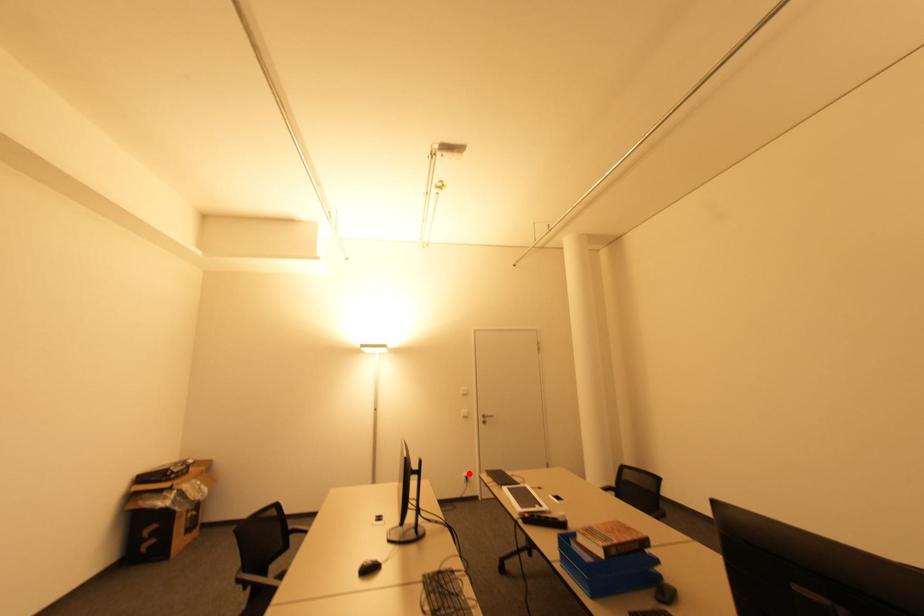
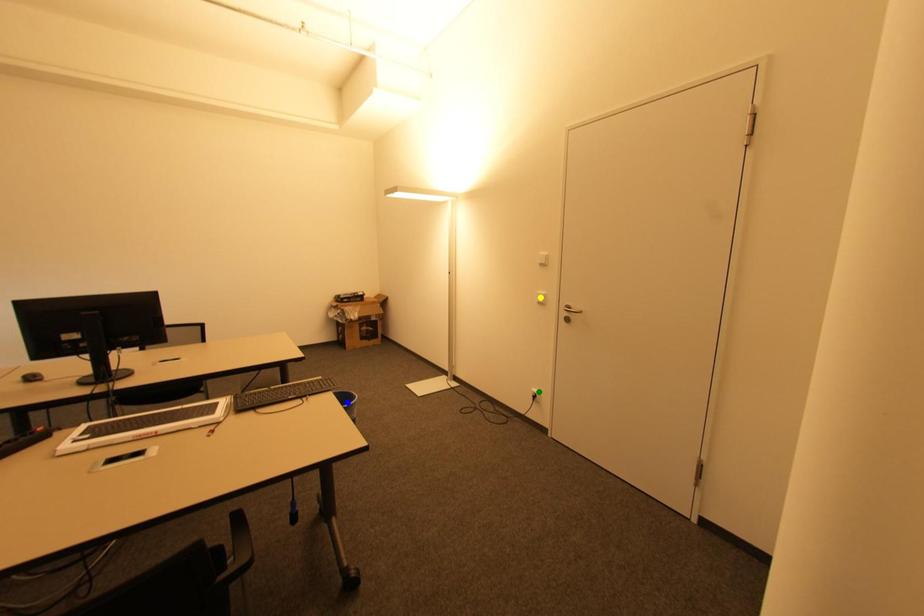
Question: I am providing you with two images of the same scene from different viewpoints. A red point is marked on the first image. You are given multiple points on the second image. In image 2, which mark is for the same physical point as the one in image 1?

Choices:
 (A) yellow point
 (B) green point
 (C) blue point

Answer: (B)